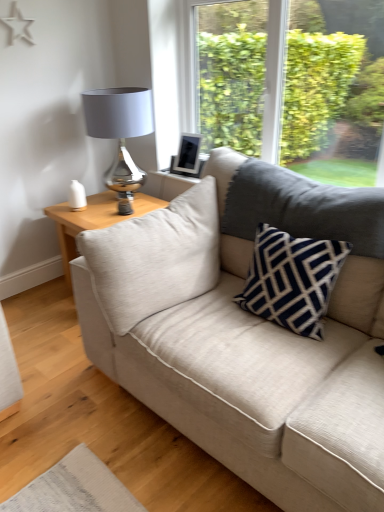
Question: Does beige fabric couch at center have a greater width compared to light wood/texture side table at left?

Choices:
 (A) no
 (B) yes

Answer: (B)

Question: From a real-world perspective, does beige fabric couch at center sit lower than light wood/texture side table at left?

Choices:
 (A) yes
 (B) no

Answer: (B)

Question: From a real-world perspective, is beige fabric couch at center located higher than light wood/texture side table at left?

Choices:
 (A) no
 (B) yes

Answer: (B)

Question: Can you confirm if beige fabric couch at center is taller than light wood/texture side table at left?

Choices:
 (A) yes
 (B) no

Answer: (A)

Question: Is beige fabric couch at center completely or partially outside of light wood/texture side table at left?

Choices:
 (A) yes
 (B) no

Answer: (A)

Question: In terms of size, does beige fabric couch at center appear bigger or smaller than matte silver table lamp at upper left?

Choices:
 (A) big
 (B) small

Answer: (A)

Question: Visually, is beige fabric couch at center positioned to the left or to the right of matte silver table lamp at upper left?

Choices:
 (A) left
 (B) right

Answer: (B)

Question: Considering the positions of point (231, 225) and point (102, 115), is point (231, 225) closer or farther from the camera than point (102, 115)?

Choices:
 (A) farther
 (B) closer

Answer: (B)

Question: Is beige fabric couch at center inside the boundaries of matte silver table lamp at upper left, or outside?

Choices:
 (A) outside
 (B) inside

Answer: (A)

Question: Visually, is beige fabric couch at center positioned to the left or to the right of navy blue textured pillow at center?

Choices:
 (A) left
 (B) right

Answer: (A)

Question: In the image, is beige fabric couch at center positioned in front of or behind navy blue textured pillow at center?

Choices:
 (A) front
 (B) behind

Answer: (A)

Question: Is point (337, 338) closer or farther from the camera than point (266, 234)?

Choices:
 (A) farther
 (B) closer

Answer: (B)

Question: From the image's perspective, is beige fabric couch at center positioned above or below navy blue textured pillow at center?

Choices:
 (A) below
 (B) above

Answer: (A)

Question: Is point (292, 501) closer or farther from the camera than point (104, 190)?

Choices:
 (A) farther
 (B) closer

Answer: (B)

Question: From the image's perspective, relative to light wood/texture side table at left, is beige fabric couch at center above or below?

Choices:
 (A) above
 (B) below

Answer: (B)